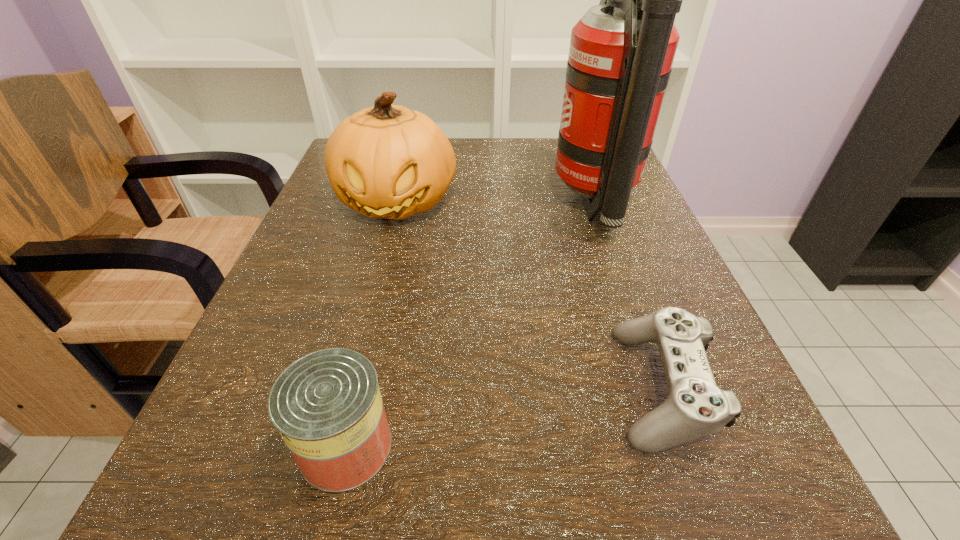
Where is `empty location between the shortest object and the can`? empty location between the shortest object and the can is located at coordinates (504, 416).

Locate an element on the screen. The width and height of the screenshot is (960, 540). vacant area that lies between the can and the pumpkin is located at coordinates (372, 324).

Where is `empty space that is in between the control and the third shortest object`? empty space that is in between the control and the third shortest object is located at coordinates (529, 294).

Locate an element on the screen. unoccupied area between the fire extinguisher and the control is located at coordinates pos(628,295).

Find the location of a particular element. free spot between the pumpkin and the shortest object is located at coordinates (529, 294).

At what (x,y) coordinates should I click in order to perform the action: click on vacant space in between the can and the tallest object. Please return your answer as a coordinate pair (x, y). The image size is (960, 540). Looking at the image, I should click on tap(470, 326).

At what (x,y) coordinates should I click in order to perform the action: click on the second closest object to the second tallest object. Please return your answer as a coordinate pair (x, y). This screenshot has width=960, height=540. Looking at the image, I should click on (695, 407).

The width and height of the screenshot is (960, 540). Identify the location of object that is the second closest to the control. (327, 406).

Identify the location of blank space that satisfies the following two spatial constraints: 1. on the front label side of the tallest object; 2. on the front side of the third tallest object. (679, 446).

This screenshot has height=540, width=960. What are the coordinates of `vacant space that satisfies the following two spatial constraints: 1. on the front label side of the tallest object; 2. on the front side of the can` in the screenshot? It's located at pos(679,446).